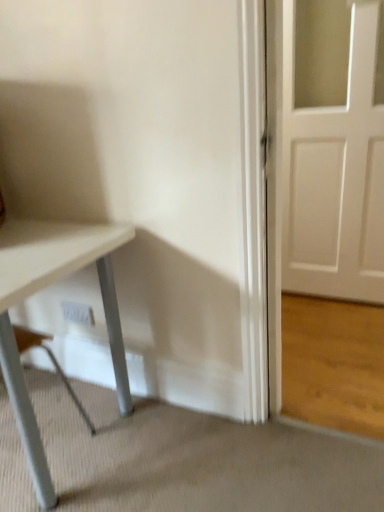
Question: In terms of width, does white matte table at lower left look wider or thinner when compared to white plastic electric outlet at lower center?

Choices:
 (A) wide
 (B) thin

Answer: (A)

Question: From the image's perspective, relative to white plastic electric outlet at lower center, is white matte table at lower left above or below?

Choices:
 (A) below
 (B) above

Answer: (A)

Question: Looking at the image, does white matte table at lower left seem bigger or smaller compared to white plastic electric outlet at lower center?

Choices:
 (A) big
 (B) small

Answer: (A)

Question: Does point (84, 320) appear closer or farther from the camera than point (33, 451)?

Choices:
 (A) farther
 (B) closer

Answer: (A)

Question: Is white plastic electric outlet at lower center bigger or smaller than white matte table at lower left?

Choices:
 (A) big
 (B) small

Answer: (B)

Question: Is white plastic electric outlet at lower center taller or shorter than white matte table at lower left?

Choices:
 (A) tall
 (B) short

Answer: (B)

Question: Is white plastic electric outlet at lower center spatially inside white matte table at lower left, or outside of it?

Choices:
 (A) inside
 (B) outside

Answer: (B)